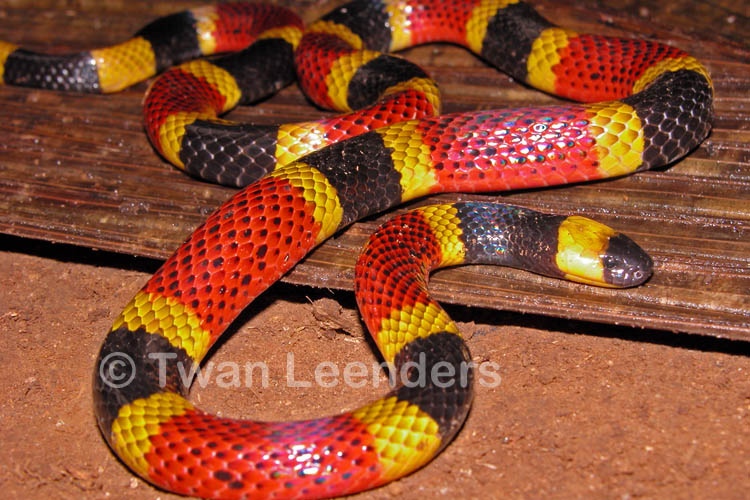
Identify the location of wooden table. (76, 162), (704, 208), (721, 29).